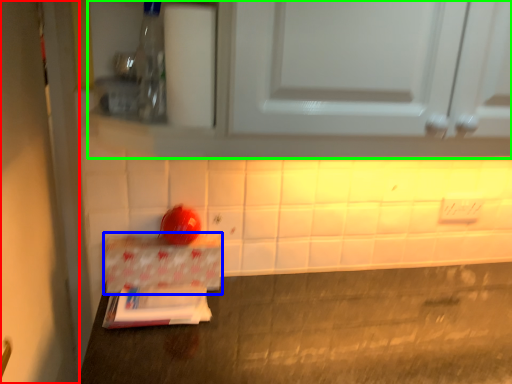
Question: Estimate the real-world distances between objects in this image. Which object is farther from door (highlighted by a red box), cardboard box (highlighted by a blue box) or cabinetry (highlighted by a green box)?

Choices:
 (A) cardboard box
 (B) cabinetry

Answer: (B)